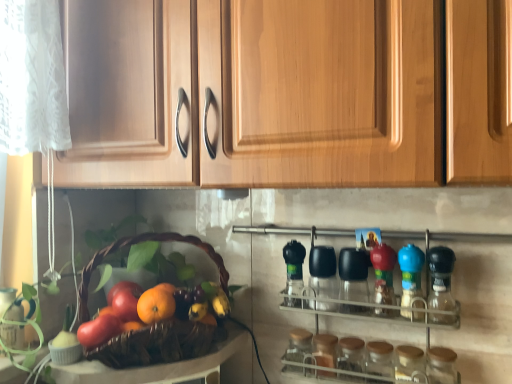
Question: Is orange matte at center at the left side of transparent glass jar at lower center, positioned as the 3th bottle in right-to-left order?

Choices:
 (A) no
 (B) yes

Answer: (B)

Question: Considering the relative sizes of orange matte at center and transparent glass jar at lower center, the second bottle positioned from the left, in the image provided, is orange matte at center taller than transparent glass jar at lower center, the second bottle positioned from the left,?

Choices:
 (A) no
 (B) yes

Answer: (A)

Question: Does orange matte at center have a smaller size compared to transparent glass jar at lower center, positioned as the 3th bottle in right-to-left order?

Choices:
 (A) yes
 (B) no

Answer: (A)

Question: From a real-world perspective, is orange matte at center below transparent glass jar at lower center, positioned as the 3th bottle in right-to-left order?

Choices:
 (A) no
 (B) yes

Answer: (A)

Question: Is orange matte at center positioned in front of transparent glass jar at lower center, the second bottle positioned from the left?

Choices:
 (A) yes
 (B) no

Answer: (A)

Question: From the image's perspective, is transparent glass jar at lower right, which is the 1th bottle from right to left, located above or below shiny purple grapes at center?

Choices:
 (A) below
 (B) above

Answer: (A)

Question: Considering the positions of transparent glass jar at lower right, which is the fourth bottle in left-to-right order, and shiny purple grapes at center in the image, is transparent glass jar at lower right, which is the fourth bottle in left-to-right order, bigger or smaller than shiny purple grapes at center?

Choices:
 (A) small
 (B) big

Answer: (A)

Question: Considering the positions of transparent glass jar at lower right, which is the 1th bottle from right to left, and shiny purple grapes at center in the image, is transparent glass jar at lower right, which is the 1th bottle from right to left, wider or thinner than shiny purple grapes at center?

Choices:
 (A) thin
 (B) wide

Answer: (A)

Question: In the image, is transparent glass jar at lower right, which is the fourth bottle in left-to-right order, positioned in front of or behind shiny purple grapes at center?

Choices:
 (A) behind
 (B) front

Answer: (B)

Question: From a real-world perspective, is transparent glass jar at lower right, which is the 1th bottle from right to left, physically located above or below green matte bottle at center, marked as the fourth bottle in a right-to-left arrangement?

Choices:
 (A) above
 (B) below

Answer: (B)

Question: Is point (436, 359) closer or farther from the camera than point (294, 299)?

Choices:
 (A) closer
 (B) farther

Answer: (A)

Question: Is transparent glass jar at lower right, which is the fourth bottle in left-to-right order, to the left or to the right of green matte bottle at center, which appears as the 1th bottle when viewed from the left, in the image?

Choices:
 (A) left
 (B) right

Answer: (B)

Question: Is transparent glass jar at lower right, which is the 1th bottle from right to left, in front of or behind green matte bottle at center, which appears as the 1th bottle when viewed from the left, in the image?

Choices:
 (A) behind
 (B) front

Answer: (B)

Question: Does point (178, 306) appear closer or farther from the camera than point (116, 322)?

Choices:
 (A) farther
 (B) closer

Answer: (A)

Question: Is shiny purple grapes at center to the left or to the right of matte red apple at lower left, placed as the 1th apple when sorted from front to back, in the image?

Choices:
 (A) left
 (B) right

Answer: (B)